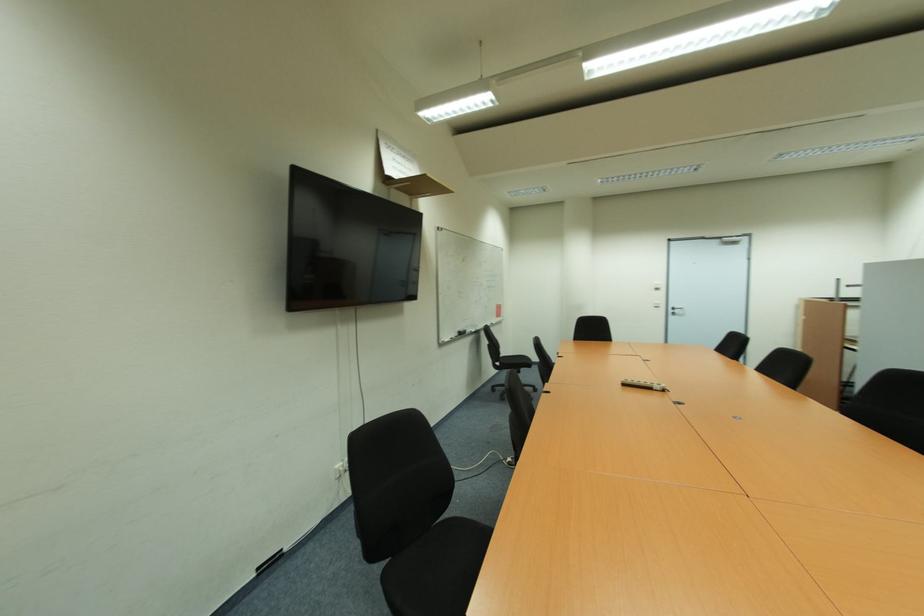
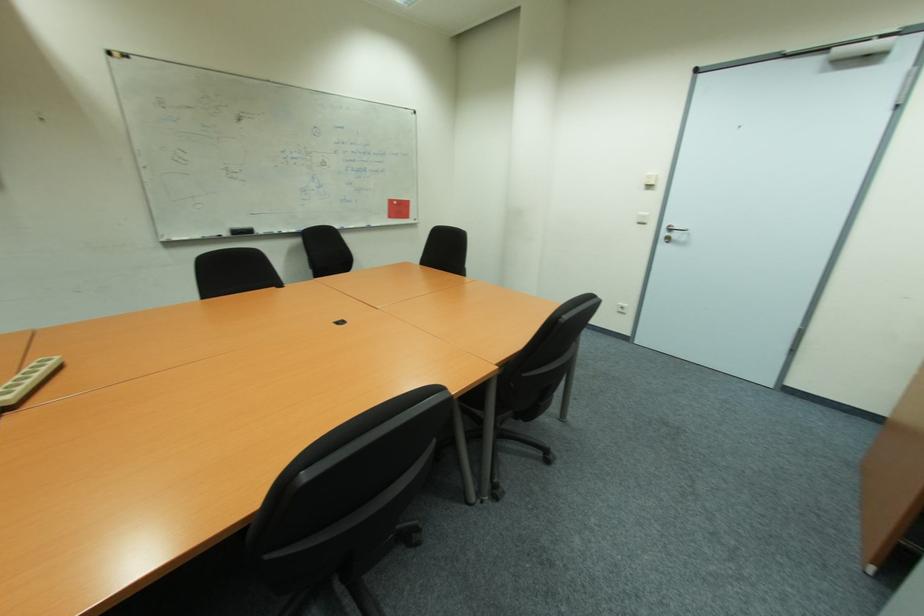
The images are taken continuously from a first-person perspective. In which direction are you moving?

The movement direction of the cameraman is right, forward.